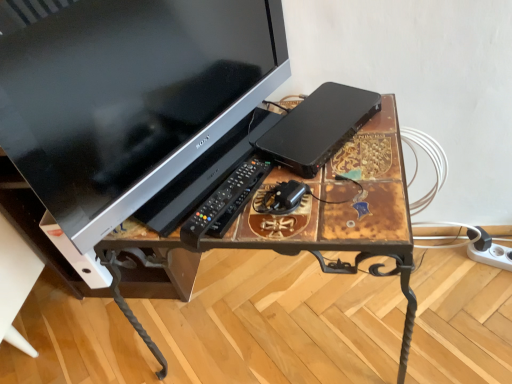
At what (x,y) coordinates should I click in order to perform the action: click on vacant space to the right of black plastic power adapter at center. Please return your answer as a coordinate pair (x, y). Looking at the image, I should click on (355, 177).